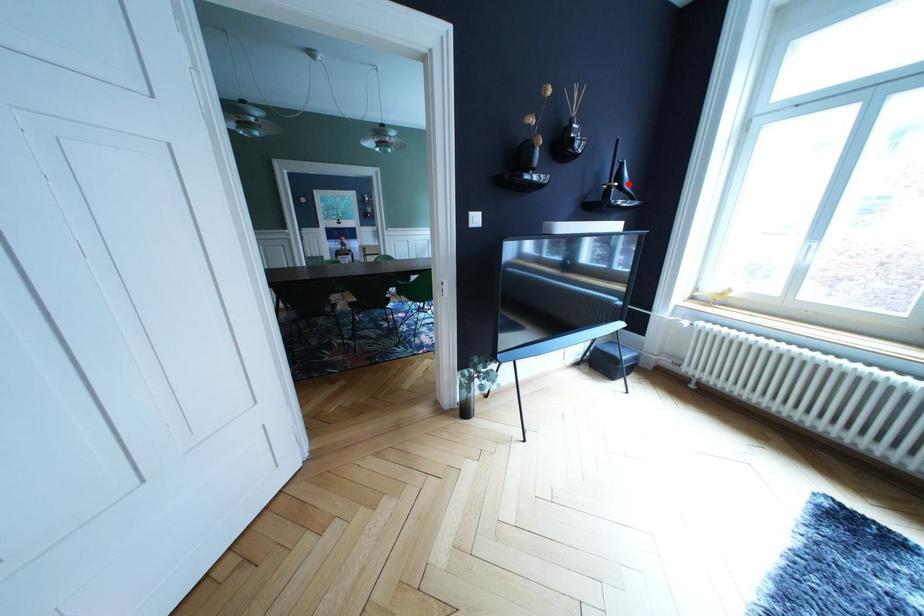
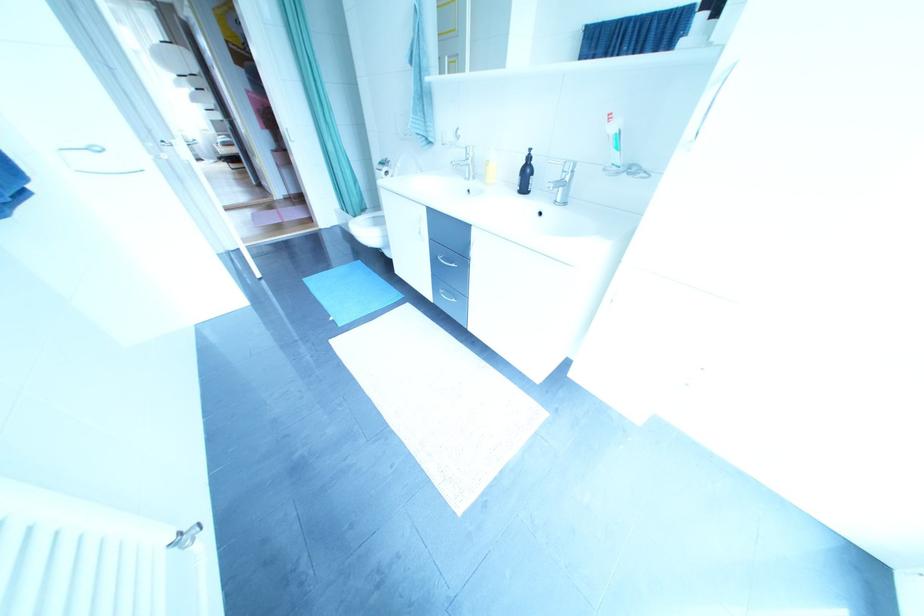
Question: I am providing you with two images of the same scene from different viewpoints. A red point is marked on the first image. At the location where the point appears in image 1, is it still visible in image 2?

Choices:
 (A) Yes
 (B) No

Answer: (B)